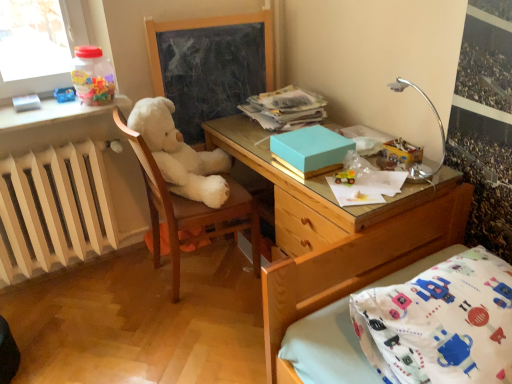
Image resolution: width=512 pixels, height=384 pixels. In order to click on unoccupied region to the right of yellow rubber toy car at center, the 2th toy in the back-to-front sequence in this screenshot , I will do `click(390, 182)`.